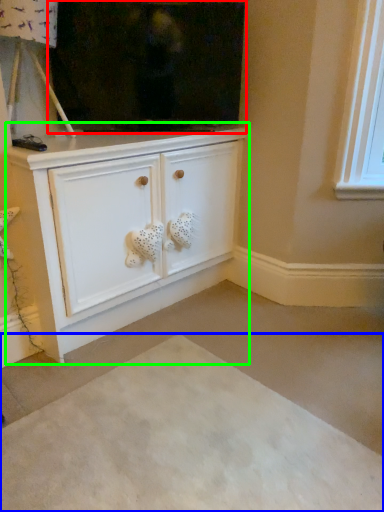
Question: Which object is positioned farthest from fireplace (highlighted by a red box)? Select from plain (highlighted by a blue box) and cabinetry (highlighted by a green box).

Choices:
 (A) plain
 (B) cabinetry

Answer: (A)